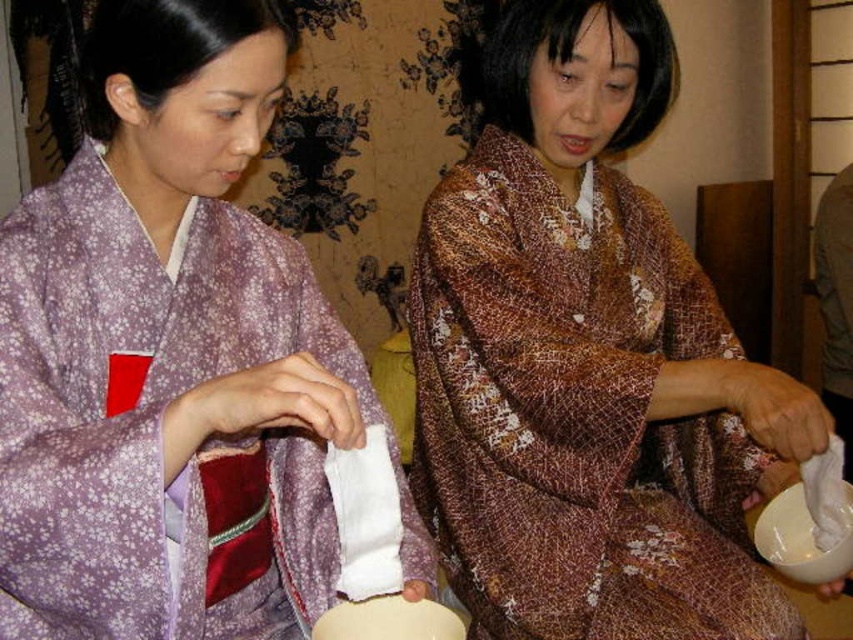
The width and height of the screenshot is (853, 640). What do you see at coordinates (167, 355) in the screenshot?
I see `purple floral kimono at center` at bounding box center [167, 355].

What do you see at coordinates (167, 355) in the screenshot? I see `purple floral kimono at center` at bounding box center [167, 355].

Find the location of a particular element. purple floral kimono at center is located at coordinates (167, 355).

How much distance is there between brown textured kimono at center and matte white bowl at lower center?

brown textured kimono at center is 22.46 inches from matte white bowl at lower center.

You are a GUI agent. You are given a task and a screenshot of the screen. Output one action in this format:
    pyautogui.click(x=<x>, y=<y>)
    Task: Click on the brown textured kimono at center
    The image size is (853, 640).
    Given the screenshot: What is the action you would take?
    (587, 362)

The image size is (853, 640). Identify the location of brown textured kimono at center. [587, 362].

Between point (844, 572) and point (834, 525), which one is positioned in front?

Point (844, 572)

Which is behind, point (775, 566) or point (825, 472)?

Positioned behind is point (775, 566).

Is point (808, 525) positioned in front of point (834, 502)?

No, it is not.

The width and height of the screenshot is (853, 640). Identify the location of white matte bowl at lower right. (802, 538).